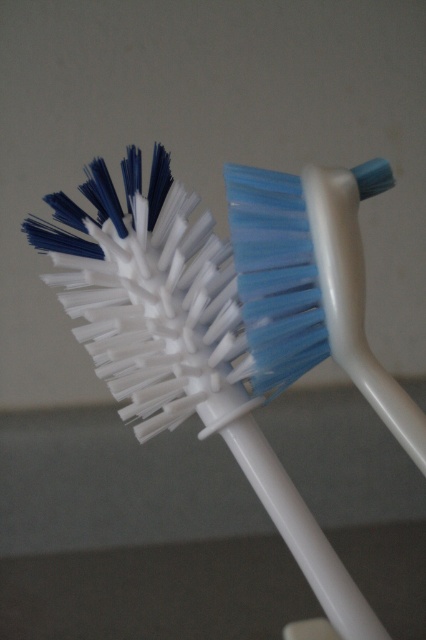
Which is below, white plastic toothbrush at center or blue plastic toothbrush at center?

Positioned lower is white plastic toothbrush at center.

Is white plastic toothbrush at center taller than blue plastic toothbrush at center?

Indeed, white plastic toothbrush at center has a greater height compared to blue plastic toothbrush at center.

Which is behind, point (215, 420) or point (236, 182)?

The point (215, 420) is more distant.

The height and width of the screenshot is (640, 426). What are the coordinates of `white plastic toothbrush at center` in the screenshot? It's located at (201, 330).